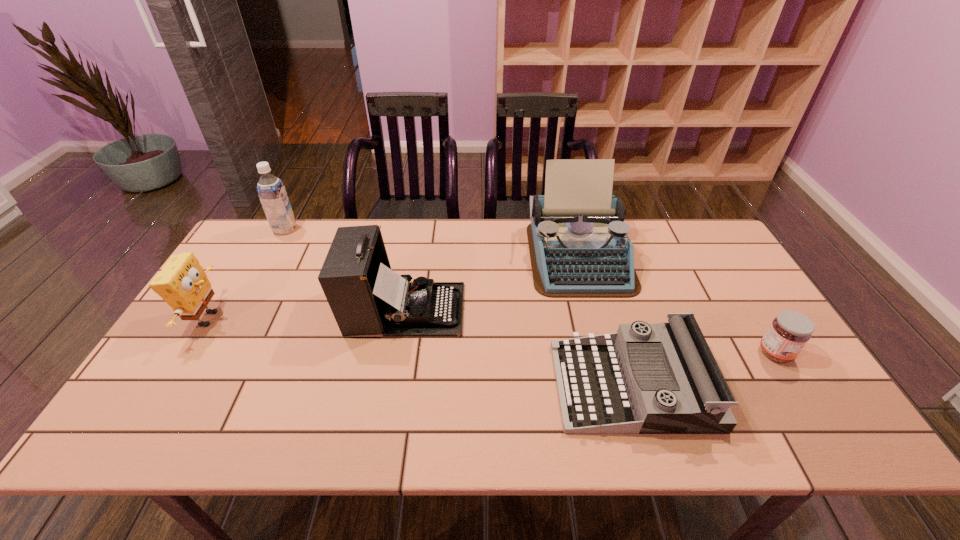
Identify the location of free space at the near edge. (380, 444).

I want to click on free space at the left edge of the desktop, so click(x=252, y=287).

The width and height of the screenshot is (960, 540). Find the location of `vacant space at the far right corner of the desktop`. vacant space at the far right corner of the desktop is located at coordinates (682, 224).

Locate an element on the screen. free space at the near right corner of the desktop is located at coordinates (803, 411).

You are a GUI agent. You are given a task and a screenshot of the screen. Output one action in this format:
    pyautogui.click(x=<x>, y=<y>)
    Task: Click on the free spot between the soya milk and the rightmost object
    The width and height of the screenshot is (960, 540).
    Given the screenshot: What is the action you would take?
    pyautogui.click(x=530, y=291)

Where is `vacant point located between the third shortest object and the leftmost typewriter`? vacant point located between the third shortest object and the leftmost typewriter is located at coordinates (306, 314).

Locate an element on the screen. The image size is (960, 540). free space that is in between the soya milk and the sponge is located at coordinates (246, 274).

Identify the location of unoccupied area between the rightmost object and the fourth tallest object. The image size is (960, 540). (492, 336).

Where is `free area in between the fourth tallest object and the soya milk`? The image size is (960, 540). free area in between the fourth tallest object and the soya milk is located at coordinates (246, 274).

Identify the location of object that ranks as the third closest to the rightmost object. (366, 297).